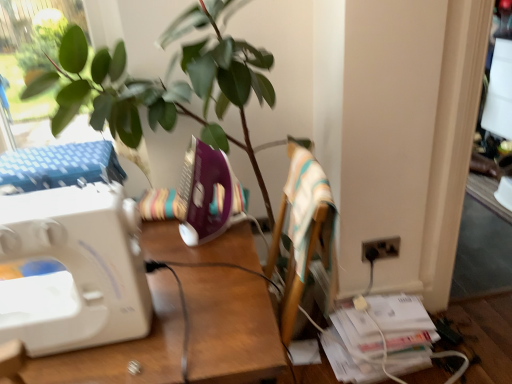
The image size is (512, 384). Find the location of `vacant space that's between white plastic sewing machine at left, the 2th sewing machine in the back-to-front sequence, and purple plastic sewing machine at center, acting as the 2th sewing machine starting from the front`. vacant space that's between white plastic sewing machine at left, the 2th sewing machine in the back-to-front sequence, and purple plastic sewing machine at center, acting as the 2th sewing machine starting from the front is located at coordinates (184, 260).